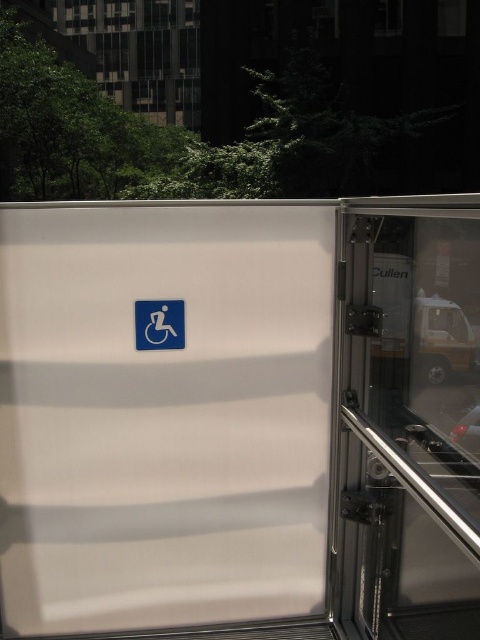
Question: Which object appears farthest from the camera in this image?

Choices:
 (A) blue plastic sign at center
 (B) transparent glass screen door at right
 (C) white matte screen door at center

Answer: (A)

Question: Based on their relative distances, which object is nearer to the blue plastic sign at center?

Choices:
 (A) white matte screen door at center
 (B) transparent glass screen door at right

Answer: (A)

Question: Is transparent glass screen door at right further to the viewer compared to blue plastic sign at center?

Choices:
 (A) no
 (B) yes

Answer: (A)

Question: Is white matte screen door at center above transparent glass screen door at right?

Choices:
 (A) yes
 (B) no

Answer: (A)

Question: Is white matte screen door at center smaller than transparent glass screen door at right?

Choices:
 (A) yes
 (B) no

Answer: (A)

Question: Which object is farther from the camera taking this photo?

Choices:
 (A) white matte screen door at center
 (B) blue plastic sign at center

Answer: (B)